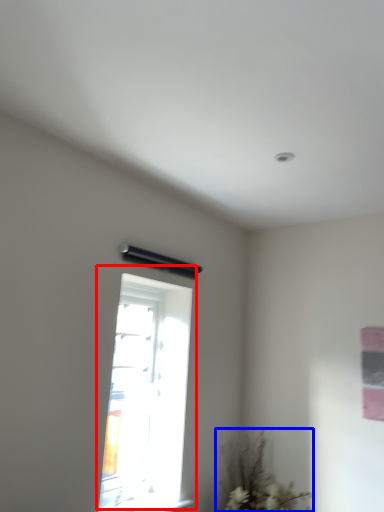
Question: Which point is closer to the camera, window (highlighted by a red box) or plant (highlighted by a blue box)?

Choices:
 (A) window
 (B) plant

Answer: (A)